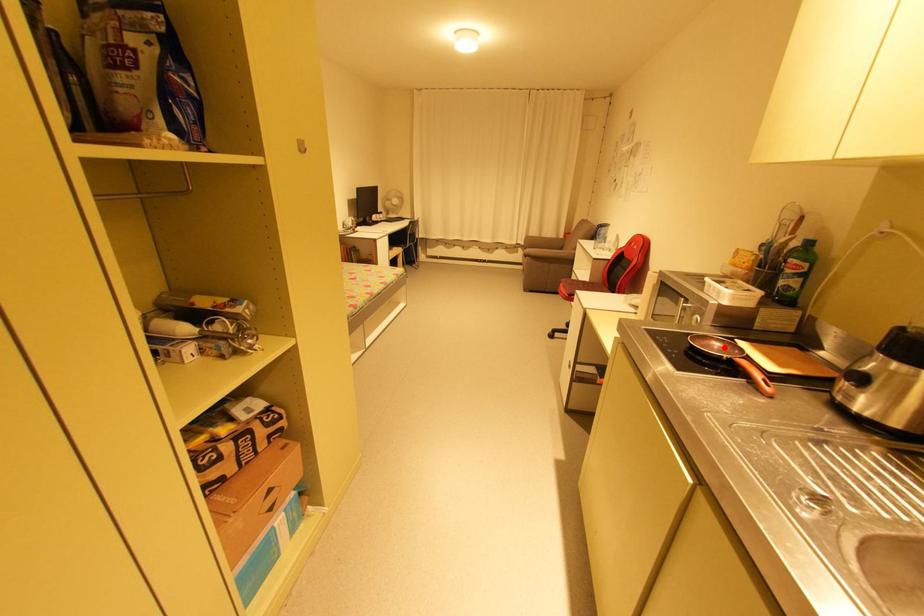
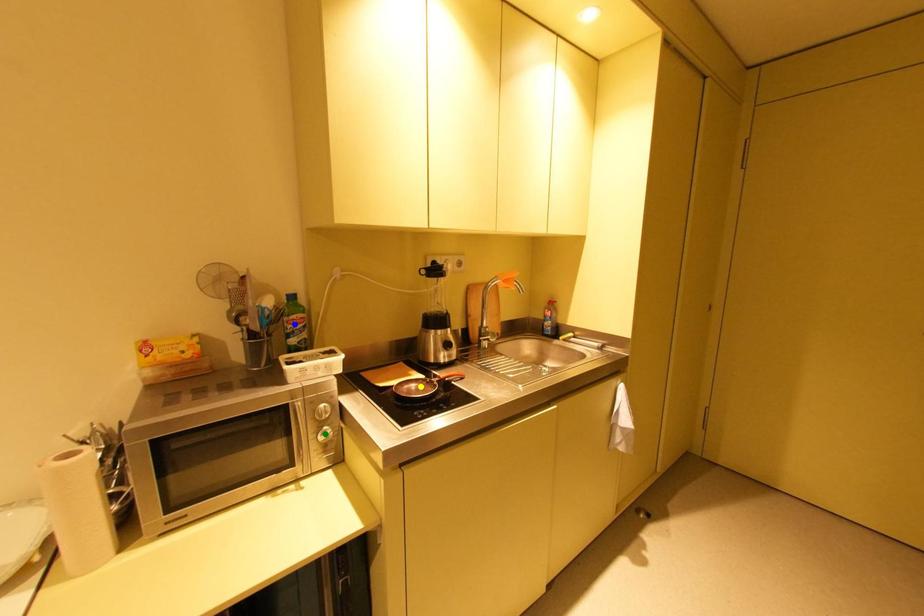
Question: I am providing you with two images of the same scene from different viewpoints. A red point is marked on the first image. You are given multiple points on the second image. In image 2, which mark is for the same physical point as the one in image 1?

Choices:
 (A) green point
 (B) yellow point
 (C) blue point

Answer: (B)